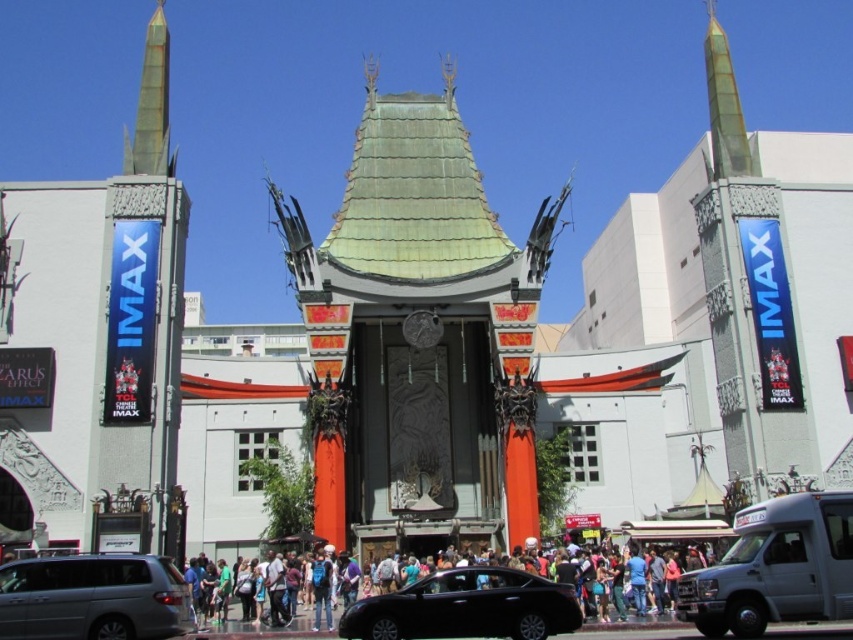
You are a delivery person with a cart that is 2 meters wide. You need to navigate through the area between the black glossy sedan at center and the matte black crowd at center at Grauman Chinese Theatre. Can your cart fit through the space between them?

The black glossy sedan at center and the matte black crowd at center are 4.18 meters apart from each other. Since your cart is 2 meters wide, it can fit through the space between them as the distance is greater than the cart width.

You are standing at point (369, 433). You want to walk to the entrance of Grauman Chinese Theatre. The entrance is 318.02 feet away. If you walk at 3 feet per second, how long will it take you to reach the entrance?

The distance between point (369, 433) and the entrance is 318.02 feet. At a walking speed of 3 feet per second, it will take 106.00666666666667 seconds, which is approximately 1 minute and 46 seconds.